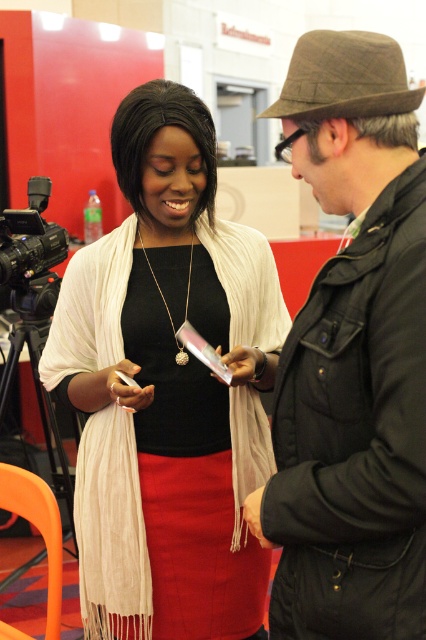
Question: Which point is farther to the camera?

Choices:
 (A) matte white scarf at center
 (B) dark brown woolen hat at upper right

Answer: (A)

Question: Which point is closer to the camera?

Choices:
 (A) matte white scarf at center
 (B) dark brown woolen hat at upper right

Answer: (B)

Question: Is matte white scarf at center bigger than dark brown woolen hat at upper right?

Choices:
 (A) no
 (B) yes

Answer: (B)

Question: Which of the following is the farthest from the observer?

Choices:
 (A) (186, 275)
 (B) (331, 173)

Answer: (A)

Question: Does matte white scarf at center appear on the right side of dark brown woolen hat at upper right?

Choices:
 (A) no
 (B) yes

Answer: (A)

Question: Can you confirm if matte white scarf at center is thinner than dark brown woolen hat at upper right?

Choices:
 (A) yes
 (B) no

Answer: (B)